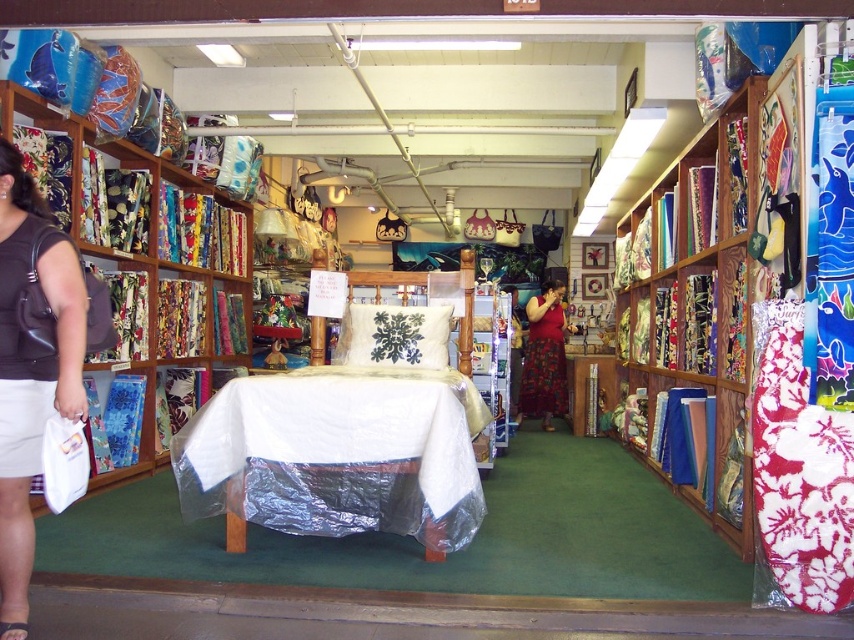
Question: Based on their relative distances, which object is nearer to the red satin dress at center?

Choices:
 (A) white plastic table at center
 (B) multicolored fabric at right
 (C) matte fabric bookshelf at left
 (D) brown leather sandal at lower left

Answer: (B)

Question: Which object is farther from the camera taking this photo?

Choices:
 (A) white plastic table at center
 (B) matte black purse at left
 (C) multicolored fabric at right

Answer: (C)

Question: From the image, what is the correct spatial relationship of white plastic table at center in relation to matte fabric bookshelf at left?

Choices:
 (A) left
 (B) right

Answer: (B)

Question: Which point is closer to the camera?

Choices:
 (A) (x=720, y=476)
 (B) (x=540, y=346)
 (C) (x=218, y=461)

Answer: (C)

Question: Does white plastic table at center appear over red satin dress at center?

Choices:
 (A) yes
 (B) no

Answer: (B)

Question: Can you confirm if white plastic table at center is positioned above multicolored fabric at right?

Choices:
 (A) yes
 (B) no

Answer: (B)